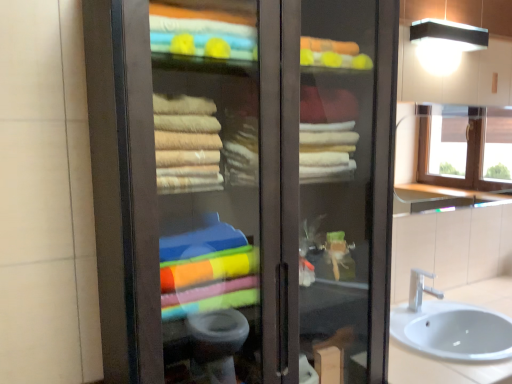
Question: Is silver metallic faucet at lower right at the right side of white ceramic sink at lower right?

Choices:
 (A) yes
 (B) no

Answer: (B)

Question: Does silver metallic faucet at lower right turn towards white ceramic sink at lower right?

Choices:
 (A) no
 (B) yes

Answer: (A)

Question: From the image's perspective, is silver metallic faucet at lower right located above white ceramic sink at lower right?

Choices:
 (A) yes
 (B) no

Answer: (A)

Question: Are silver metallic faucet at lower right and white ceramic sink at lower right far apart?

Choices:
 (A) no
 (B) yes

Answer: (A)

Question: Considering the relative sizes of silver metallic faucet at lower right and white ceramic sink at lower right in the image provided, is silver metallic faucet at lower right smaller than white ceramic sink at lower right?

Choices:
 (A) yes
 (B) no

Answer: (A)

Question: Considering the positions of black matte light fixture at upper right and silver metallic faucet at lower right in the image, is black matte light fixture at upper right taller or shorter than silver metallic faucet at lower right?

Choices:
 (A) tall
 (B) short

Answer: (B)

Question: From a real-world perspective, relative to silver metallic faucet at lower right, is black matte light fixture at upper right vertically above or below?

Choices:
 (A) below
 (B) above

Answer: (B)

Question: Looking at the image, does black matte light fixture at upper right seem bigger or smaller compared to silver metallic faucet at lower right?

Choices:
 (A) big
 (B) small

Answer: (A)

Question: From the image's perspective, is black matte light fixture at upper right located above or below silver metallic faucet at lower right?

Choices:
 (A) below
 (B) above

Answer: (B)

Question: Considering the positions of point (440, 104) and point (187, 292), is point (440, 104) closer or farther from the camera than point (187, 292)?

Choices:
 (A) farther
 (B) closer

Answer: (A)

Question: From a real-world perspective, is clear glass window at upper right above or below matte glass cabinet at center?

Choices:
 (A) below
 (B) above

Answer: (B)

Question: Considering the positions of clear glass window at upper right and matte glass cabinet at center in the image, is clear glass window at upper right bigger or smaller than matte glass cabinet at center?

Choices:
 (A) small
 (B) big

Answer: (A)

Question: In the image, is clear glass window at upper right positioned in front of or behind matte glass cabinet at center?

Choices:
 (A) behind
 (B) front

Answer: (A)

Question: From the image's perspective, relative to silver metallic faucet at lower right, is matte glass cabinet at center above or below?

Choices:
 (A) above
 (B) below

Answer: (A)

Question: Is matte glass cabinet at center bigger or smaller than silver metallic faucet at lower right?

Choices:
 (A) big
 (B) small

Answer: (A)